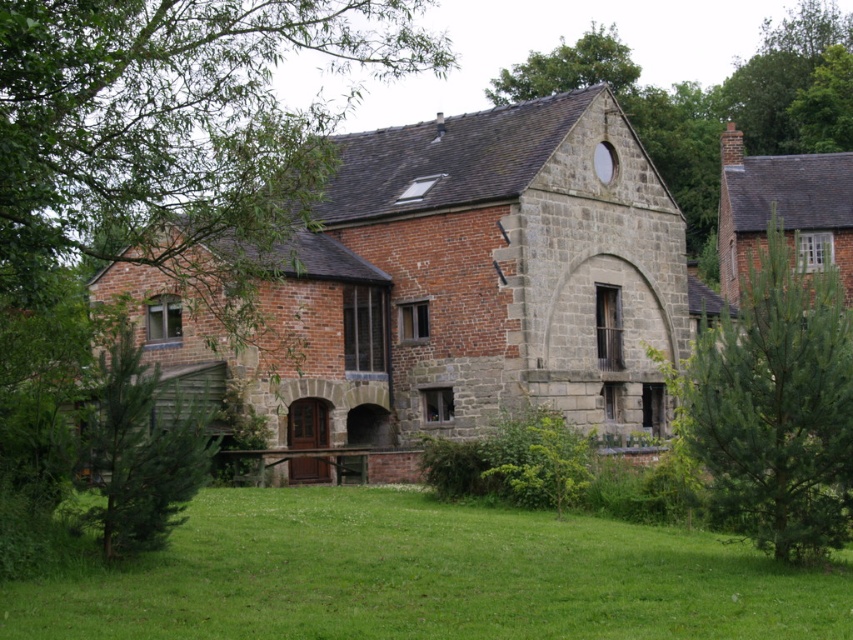
This screenshot has width=853, height=640. What do you see at coordinates (426, 577) in the screenshot?
I see `green grass at lower center` at bounding box center [426, 577].

Find the location of a particular element. Image resolution: width=853 pixels, height=640 pixels. green grass at lower center is located at coordinates (426, 577).

The image size is (853, 640). Identify the location of green grass at lower center. (426, 577).

At what (x,y) coordinates should I click in order to perform the action: click on green needle-like tree at center-right. Please return your answer as a coordinate pair (x, y). Image resolution: width=853 pixels, height=640 pixels. Looking at the image, I should click on (775, 404).

Is green needle-like tree at center-right bigger than green leafy tree at upper center?

Incorrect, green needle-like tree at center-right is not larger than green leafy tree at upper center.

Between point (846, 417) and point (496, 102), which one is positioned behind?

The point (496, 102) is more distant.

Locate an element on the screen. Image resolution: width=853 pixels, height=640 pixels. green needle-like tree at center-right is located at coordinates (775, 404).

Does brick stone chapel at center lie in front of green needle-like tree at center-right?

No, brick stone chapel at center is behind green needle-like tree at center-right.

In order to click on brick stone chapel at center in this screenshot , I will do `click(480, 280)`.

Locate an element on the screen. Image resolution: width=853 pixels, height=640 pixels. brick stone chapel at center is located at coordinates pyautogui.click(x=480, y=280).